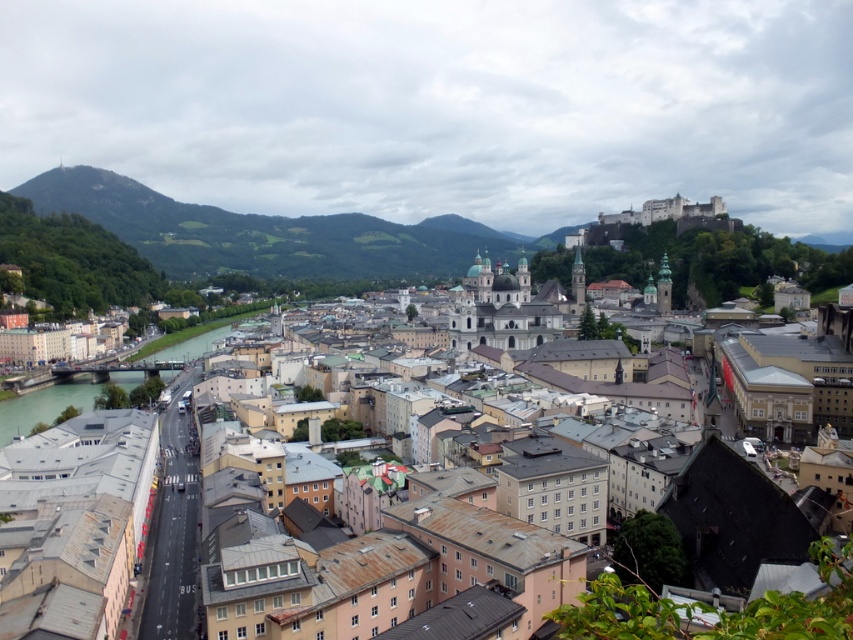
Question: Can you confirm if brown/rooftops town at center is positioned to the left of green stone river at lower left?

Choices:
 (A) no
 (B) yes

Answer: (A)

Question: Does brown/rooftops town at center lie in front of green stone river at lower left?

Choices:
 (A) yes
 (B) no

Answer: (A)

Question: Which object is the farthest from the green grassy hill at left?

Choices:
 (A) brown/rooftops town at center
 (B) green stone river at lower left

Answer: (A)

Question: Is brown/rooftops town at center to the right of green grassy hill at left from the viewer's perspective?

Choices:
 (A) yes
 (B) no

Answer: (A)

Question: Which point is closer to the camera?

Choices:
 (A) coord(836,566)
 (B) coord(10,408)
 (C) coord(74,205)

Answer: (A)

Question: Which of the following is the closest to the observer?

Choices:
 (A) green stone river at lower left
 (B) brown/rooftops town at center

Answer: (B)